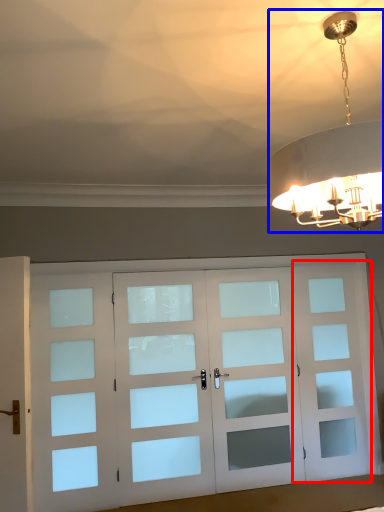
Question: Which object is further to the camera taking this photo, screen door (highlighted by a red box) or lamp (highlighted by a blue box)?

Choices:
 (A) screen door
 (B) lamp

Answer: (A)